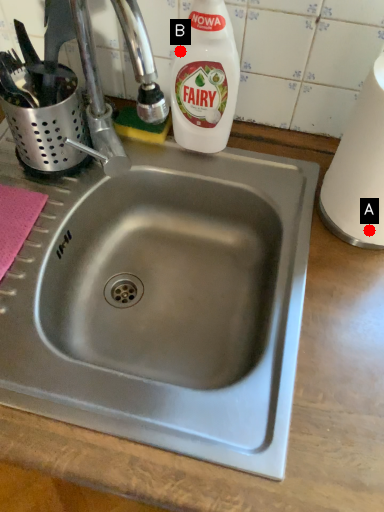
Question: Two points are circled on the image, labeled by A and B beside each circle. Which point appears closest to the camera in this image?

Choices:
 (A) A is closer
 (B) B is closer

Answer: (A)